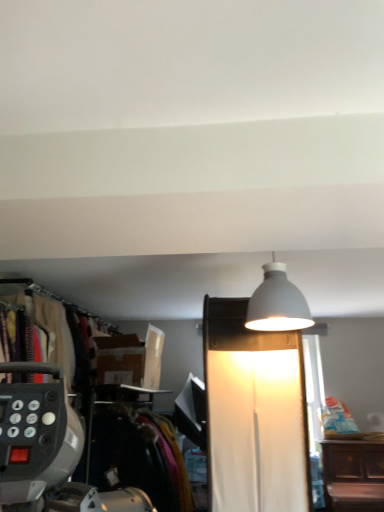
Question: From their relative heights in the image, would you say white matte lampshade at upper center, marked as the second lamp in a bottom-to-top arrangement, is taller or shorter than white matte lamp at upper center, the second lamp when ordered from top to bottom?

Choices:
 (A) tall
 (B) short

Answer: (B)

Question: Visually, is white matte lampshade at upper center, positioned as the first lamp in top-to-bottom order, positioned to the left or to the right of white matte lamp at upper center, the second lamp when ordered from top to bottom?

Choices:
 (A) left
 (B) right

Answer: (B)

Question: Considering the real-world distances, which object is closest to the white matte lampshade at upper center, marked as the second lamp in a bottom-to-top arrangement?

Choices:
 (A) velvet-like fabric at left
 (B) white matte lamp at upper center, the second lamp when ordered from top to bottom
 (C) black fabric closet at left

Answer: (B)

Question: Which object is positioned closest to the black fabric closet at left?

Choices:
 (A) velvet-like fabric at left
 (B) white matte lamp at upper center, the 1th lamp from the bottom
 (C) white matte lampshade at upper center, positioned as the first lamp in top-to-bottom order

Answer: (A)